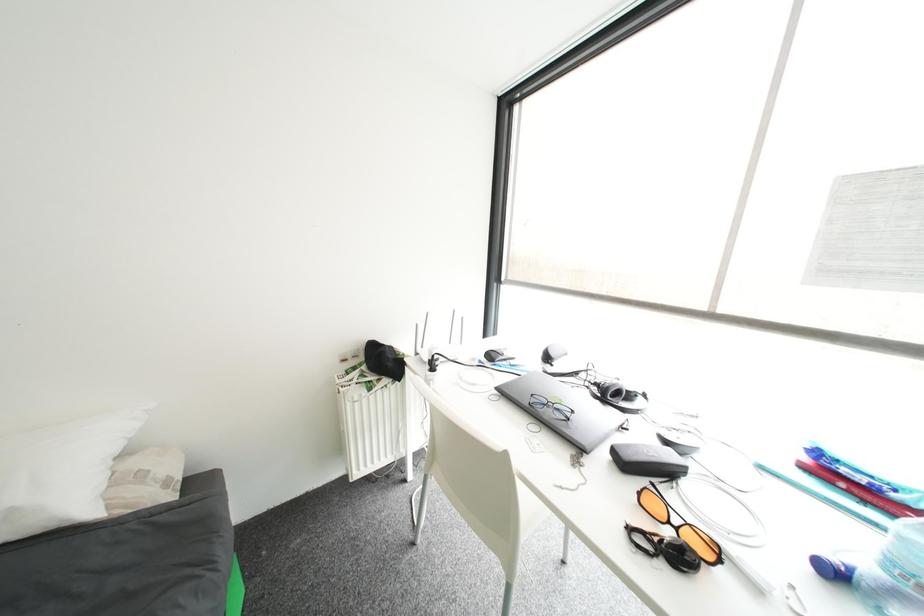
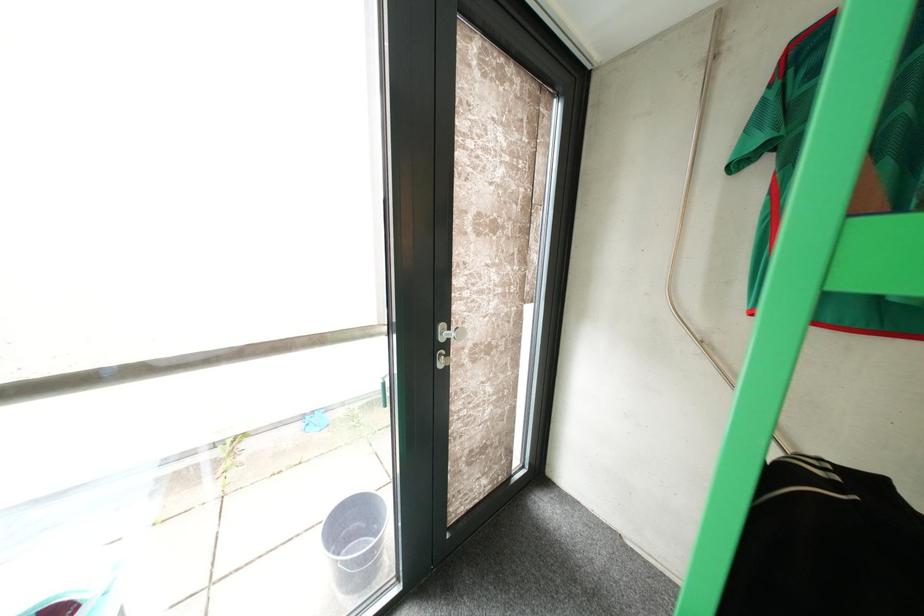
Question: Based on the continuous images, in which direction is the camera rotating? Reply with the corresponding letter.

Choices:
 (A) Left
 (B) Right
 (C) Up
 (D) Down

Answer: (B)